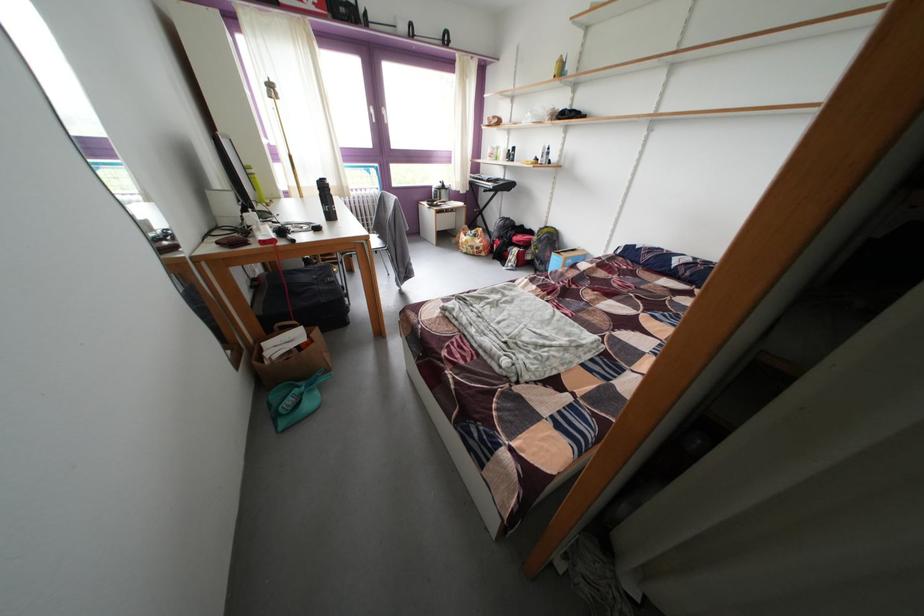
At what (x,y) coordinates should I click in order to perform the action: click on blue cardboard box. Please return your answer as a coordinate pair (x, y). The image size is (924, 616). Looking at the image, I should click on (565, 257).